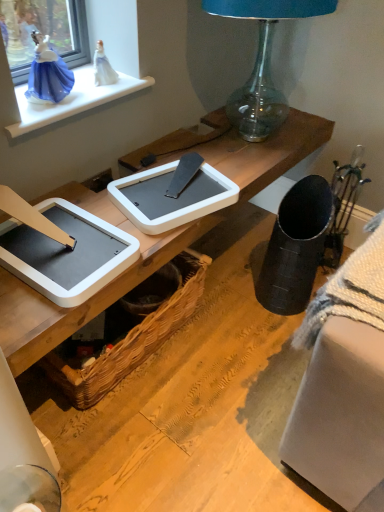
Question: Is white plastic tablet at center, the 1th tablet computer positioned from the right, not near woven brown picnic basket at lower center?

Choices:
 (A) no
 (B) yes

Answer: (A)

Question: Does white plastic tablet at center, the 1th tablet computer positioned from the right, have a lesser width compared to woven brown picnic basket at lower center?

Choices:
 (A) yes
 (B) no

Answer: (B)

Question: Does white plastic tablet at center, the 1th tablet computer positioned from the right, have a lesser height compared to woven brown picnic basket at lower center?

Choices:
 (A) no
 (B) yes

Answer: (B)

Question: Are white plastic tablet at center, which is the second tablet computer in left-to-right order, and woven brown picnic basket at lower center making contact?

Choices:
 (A) no
 (B) yes

Answer: (A)

Question: Can you confirm if white plastic tablet at center, the 1th tablet computer positioned from the right, is taller than woven brown picnic basket at lower center?

Choices:
 (A) yes
 (B) no

Answer: (B)

Question: In terms of width, does white plastic tablet at center, acting as the first tablet computer starting from the left, look wider or thinner when compared to white glossy window sill at upper left?

Choices:
 (A) thin
 (B) wide

Answer: (B)

Question: From a real-world perspective, is white plastic tablet at center, acting as the first tablet computer starting from the left, above or below white glossy window sill at upper left?

Choices:
 (A) above
 (B) below

Answer: (B)

Question: Considering the positions of white plastic tablet at center, acting as the second tablet computer starting from the right, and white glossy window sill at upper left in the image, is white plastic tablet at center, acting as the second tablet computer starting from the right, taller or shorter than white glossy window sill at upper left?

Choices:
 (A) tall
 (B) short

Answer: (A)

Question: Is point (129, 266) positioned closer to the camera than point (41, 125)?

Choices:
 (A) closer
 (B) farther

Answer: (A)

Question: Looking at their shapes, would you say white plastic tablet at center, acting as the first tablet computer starting from the left, is wider or thinner than white plastic tablet at center, which is the second tablet computer in left-to-right order?

Choices:
 (A) thin
 (B) wide

Answer: (B)

Question: Does point (91, 234) appear closer or farther from the camera than point (215, 199)?

Choices:
 (A) closer
 (B) farther

Answer: (A)

Question: From a real-world perspective, is white plastic tablet at center, acting as the first tablet computer starting from the left, above or below white plastic tablet at center, the 1th tablet computer positioned from the right?

Choices:
 (A) above
 (B) below

Answer: (A)

Question: Considering the relative positions of white plastic tablet at center, acting as the first tablet computer starting from the left, and white plastic tablet at center, the 1th tablet computer positioned from the right, in the image provided, is white plastic tablet at center, acting as the first tablet computer starting from the left, to the left or to the right of white plastic tablet at center, the 1th tablet computer positioned from the right,?

Choices:
 (A) right
 (B) left

Answer: (B)

Question: From the image's perspective, relative to white glossy window sill at upper left, is woven brown picnic basket at lower center above or below?

Choices:
 (A) below
 (B) above

Answer: (A)

Question: Considering the relative positions of woven brown picnic basket at lower center and white glossy window sill at upper left in the image provided, is woven brown picnic basket at lower center to the left or to the right of white glossy window sill at upper left?

Choices:
 (A) left
 (B) right

Answer: (B)